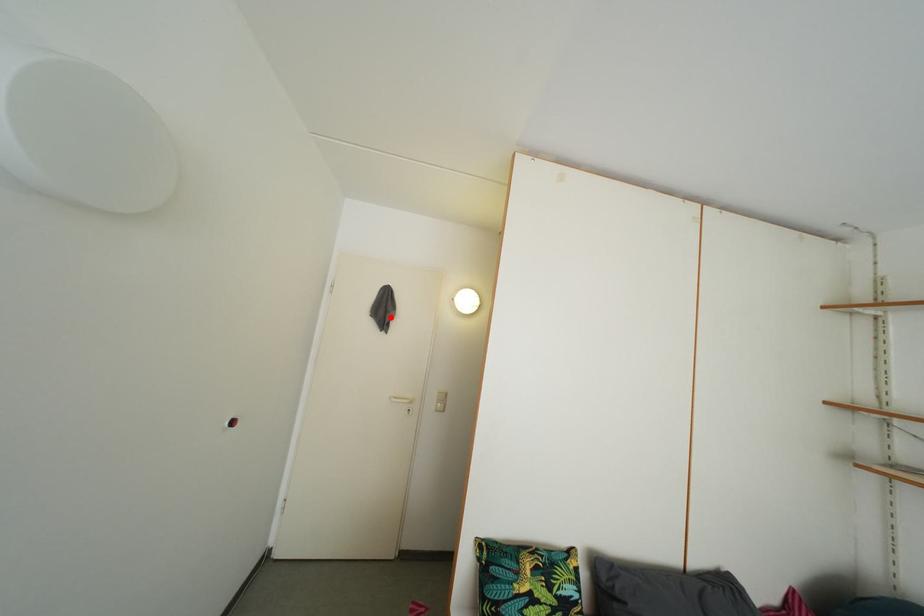
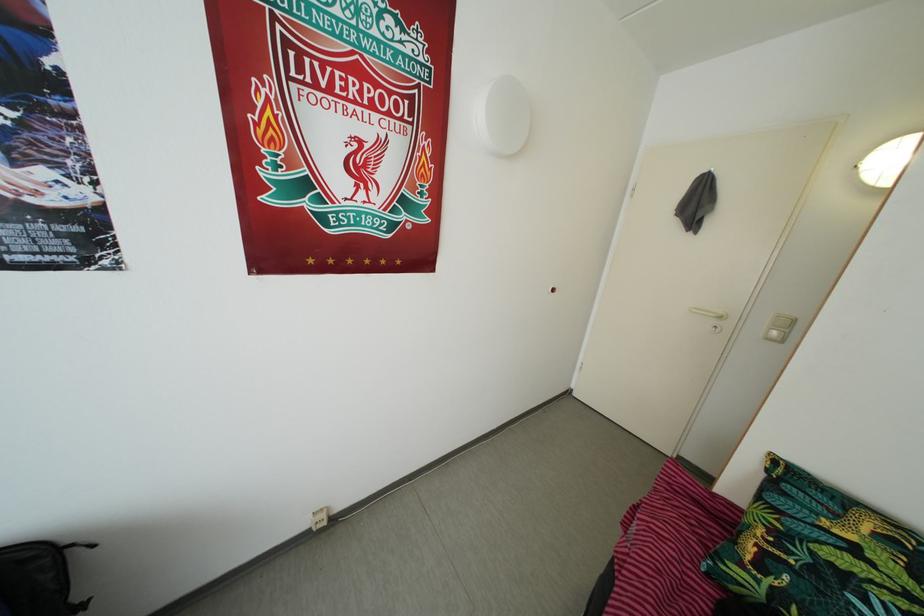
The point at the highlighted location is marked in the first image. Where is the corresponding point in the second image?

(703, 213)